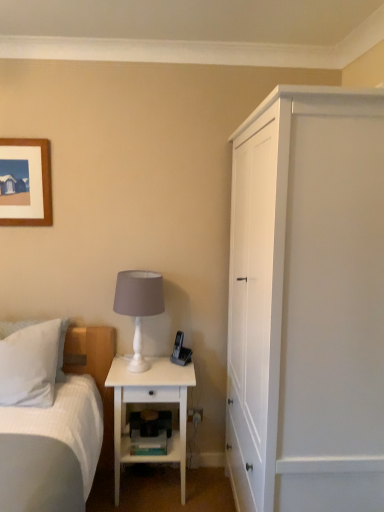
Question: From a real-world perspective, relative to white matte table lamp at center, is white matte nightstand at lower center vertically above or below?

Choices:
 (A) above
 (B) below

Answer: (B)

Question: Looking at the image, does white matte nightstand at lower center seem bigger or smaller compared to white matte table lamp at center?

Choices:
 (A) small
 (B) big

Answer: (B)

Question: Which object is the farthest from the white soft pillow at left?

Choices:
 (A) white matte table lamp at center
 (B) white matte nightstand at lower center
 (C) white matte cabinet at right

Answer: (C)

Question: Estimate the real-world distances between objects in this image. Which object is farther from the white matte table lamp at center?

Choices:
 (A) white matte cabinet at right
 (B) white soft pillow at left
 (C) white matte nightstand at lower center

Answer: (A)